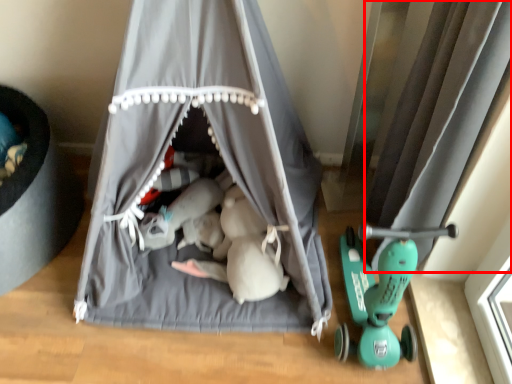
Question: From the image, what is the correct spatial relationship of curtain (annotated by the red box) in relation to curtain?

Choices:
 (A) left
 (B) right

Answer: (B)